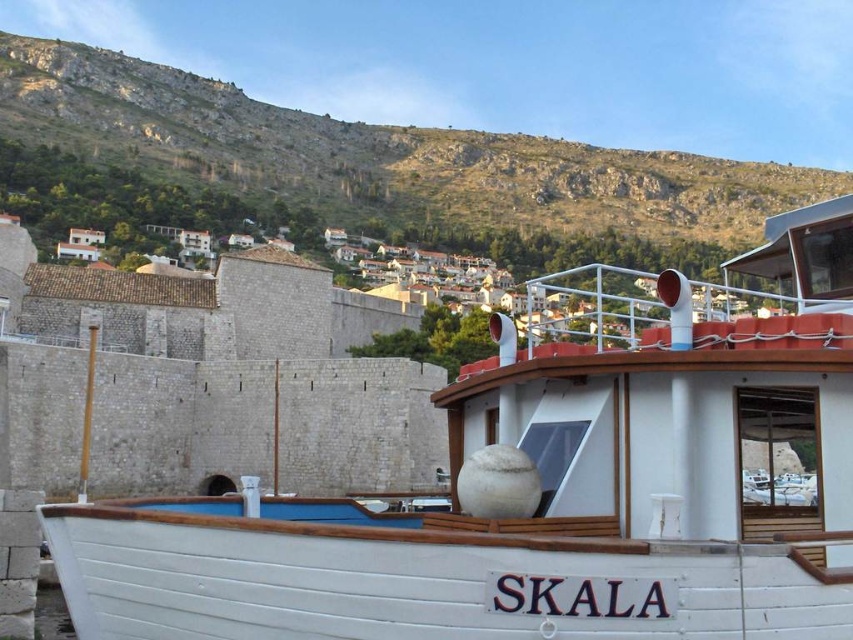
Question: Among these points, which one is nearest to the camera?

Choices:
 (A) (201, 152)
 (B) (474, 616)

Answer: (B)

Question: Does white wooden boat at center appear on the right side of green grassy hillside at upper center?

Choices:
 (A) yes
 (B) no

Answer: (B)

Question: Among these objects, which one is farthest from the camera?

Choices:
 (A) green grassy hillside at upper center
 (B) white wooden boat at center

Answer: (A)

Question: From the image, what is the correct spatial relationship of white wooden boat at center in relation to green grassy hillside at upper center?

Choices:
 (A) left
 (B) right

Answer: (A)

Question: Observing the image, what is the correct spatial positioning of white wooden boat at center in reference to green grassy hillside at upper center?

Choices:
 (A) right
 (B) left

Answer: (B)